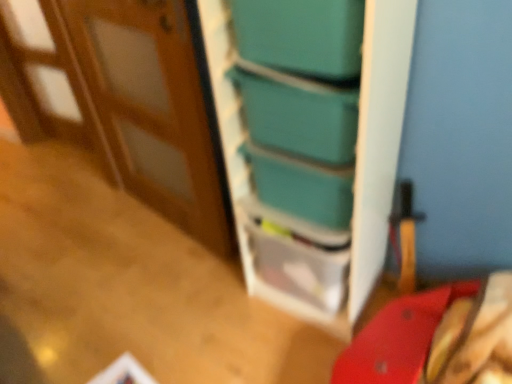
Where is `vacant region under wooden at left (from a real-world perspective)`? This screenshot has height=384, width=512. vacant region under wooden at left (from a real-world perspective) is located at coordinates (159, 239).